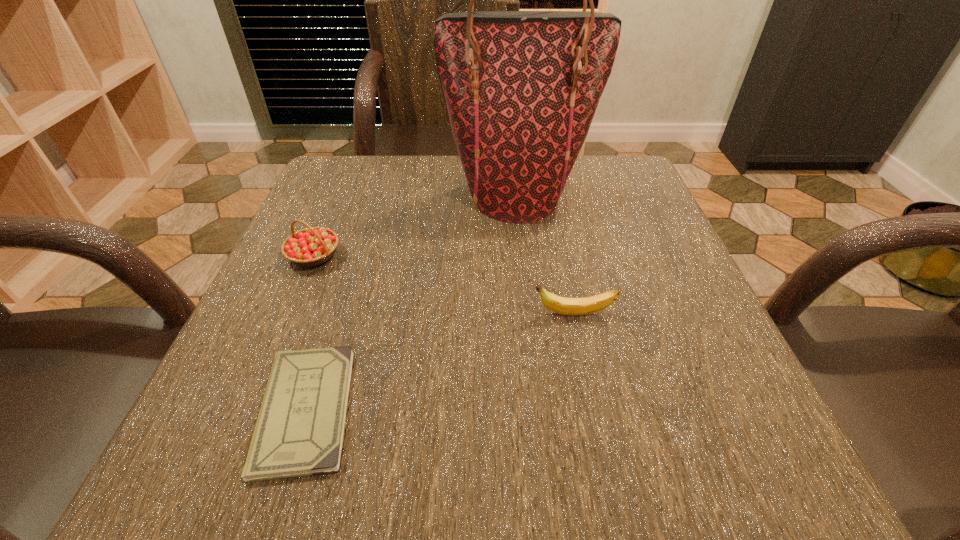
Locate an element on the screen. free space located at the stem of the third farthest object is located at coordinates (323, 314).

Identify the location of vacant space located 0.180m at the stem of the third farthest object. point(424,314).

This screenshot has height=540, width=960. In order to click on vacant space located at the stem of the third farthest object in this screenshot , I will do tap(400, 314).

Find the location of a particular element. vacant region located 0.120m on the back of the shortest object is located at coordinates (342, 296).

You are a GUI agent. You are given a task and a screenshot of the screen. Output one action in this format:
    pyautogui.click(x=<x>, y=<y>)
    Task: Click on the object present at the far edge
    
    Given the screenshot: What is the action you would take?
    pyautogui.click(x=521, y=87)

At what (x,y) coordinates should I click in order to perform the action: click on object at the near edge. Please return your answer as a coordinate pair (x, y). The width and height of the screenshot is (960, 540). Looking at the image, I should click on (300, 429).

This screenshot has width=960, height=540. I want to click on strawberry that is positioned at the left edge, so click(x=312, y=246).

The image size is (960, 540). Find the location of `checkbook present at the left edge`. checkbook present at the left edge is located at coordinates (300, 429).

Locate an element on the screen. handbag present at the right edge is located at coordinates (521, 87).

You are a GUI agent. You are given a task and a screenshot of the screen. Output one action in this format:
    pyautogui.click(x=<x>, y=<y>)
    Task: Click on the banana at the right edge
    
    Given the screenshot: What is the action you would take?
    pyautogui.click(x=566, y=306)